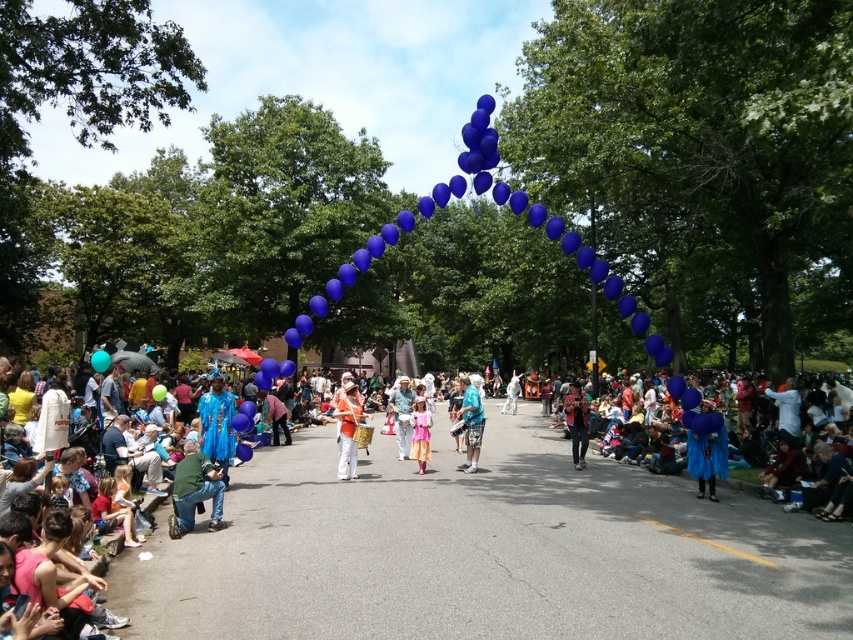
You are a photographer trying to capture the entire parade scene. You notice the blue fabric crowd at right and the matte orange drum at center. Which object should you focus on first if you want to ensure both are in frame?

You should focus on the matte orange drum at center first because the blue fabric crowd at right is positioned to its right side, so centering the drum will help frame both elements effectively.

You are a photographer positioned at the front of the parade route. You want to take a photo that includes both the blue fabric crowd at right and the matte blue costume at center. Which of these two objects will appear larger in your photo?

The blue fabric crowd at right appears larger in the photo because it is closer to the viewer than the matte blue costume at center.

You are a photographer standing at the center of the parade. You want to capture a photo that includes both the blue fabric crowd at right and the matte blue costume at center. Given that your camera has a maximum focus range of 30 feet, will you be able to capture both subjects in focus?

The distance between the blue fabric crowd at right and the matte blue costume at center is 29.81 feet, which is within the camera maximum focus range of 30 feet. Therefore, both subjects can be captured in focus.